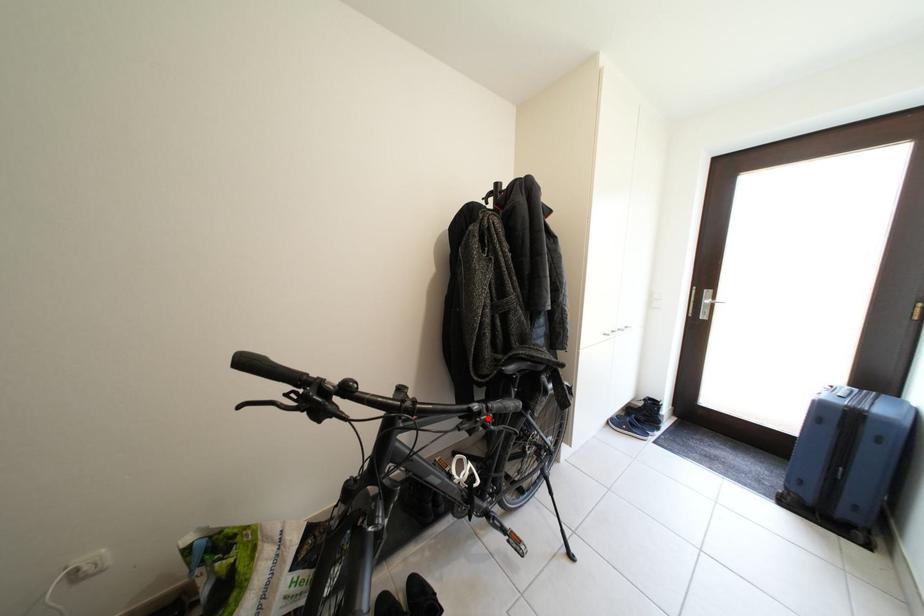
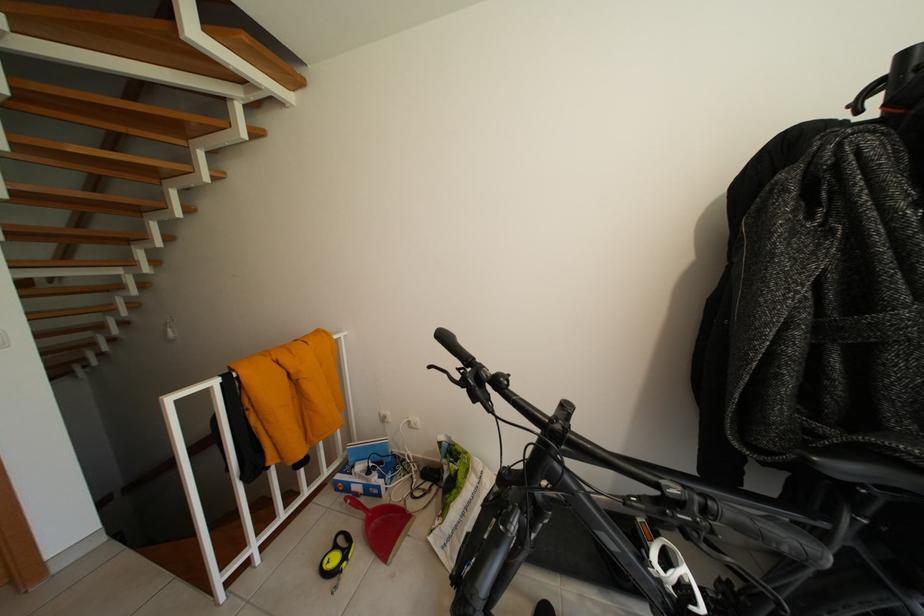
The point at the highlighted location is marked in the first image. Where is the corresponding point in the second image?

(688, 509)